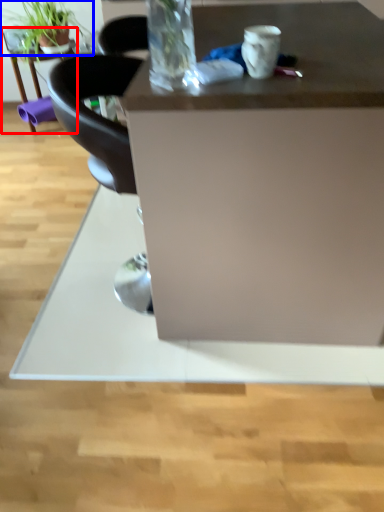
Question: Which object is closer to the camera taking this photo, table (highlighted by a red box) or houseplant (highlighted by a blue box)?

Choices:
 (A) table
 (B) houseplant

Answer: (B)